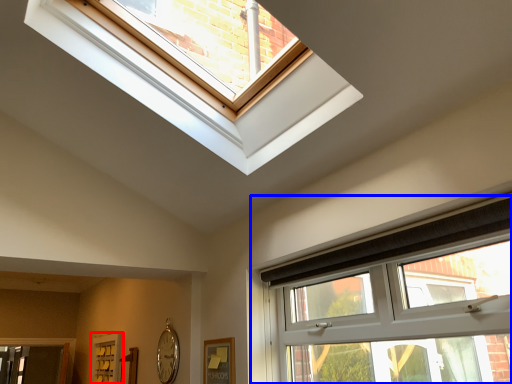
Question: Which point is further to the camera, screen door (highlighted by a red box) or window (highlighted by a blue box)?

Choices:
 (A) screen door
 (B) window

Answer: (A)